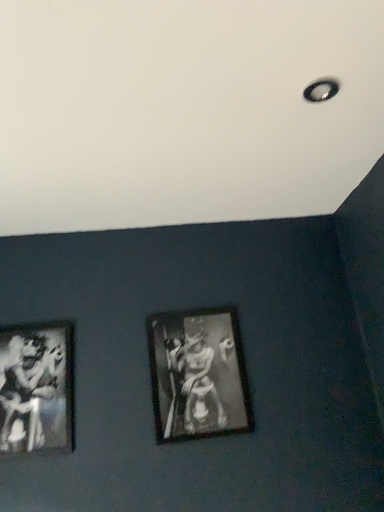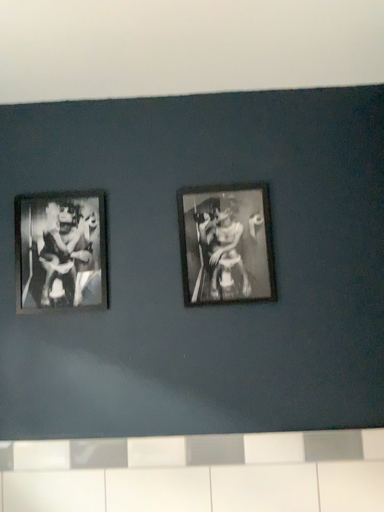
Question: Which way did the camera rotate in the video?

Choices:
 (A) rotated downward
 (B) rotated upward

Answer: (A)